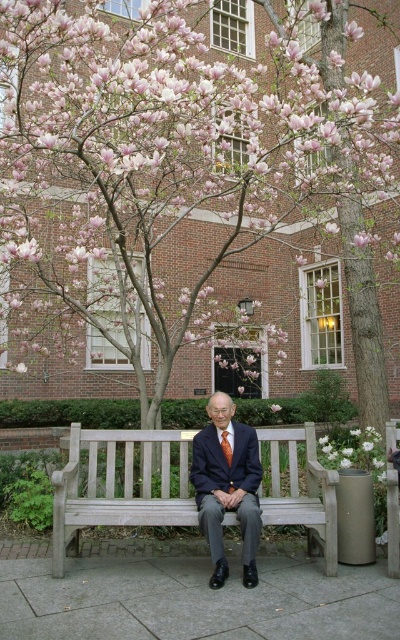
Question: Estimate the real-world distances between objects in this image. Which object is farther from the pink blossom tree at center?

Choices:
 (A) wooden bench at center
 (B) orange silk tie at center
 (C) dark blue suit at center

Answer: (B)

Question: Is pink blossom tree at center thinner than orange silk tie at center?

Choices:
 (A) no
 (B) yes

Answer: (A)

Question: Can you confirm if dark blue suit at center is smaller than orange silk tie at center?

Choices:
 (A) no
 (B) yes

Answer: (A)

Question: Which object is closer to the camera taking this photo?

Choices:
 (A) wooden bench at center
 (B) dark blue suit at center

Answer: (B)

Question: Based on their relative distances, which object is nearer to the pink blossom tree at center?

Choices:
 (A) orange silk tie at center
 (B) wooden bench at center
 (C) dark blue suit at center

Answer: (B)

Question: Is wooden bench at center positioned before dark blue suit at center?

Choices:
 (A) no
 (B) yes

Answer: (A)